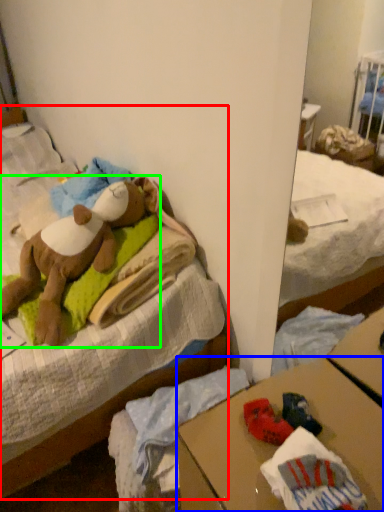
Question: Which object is the farthest from bed (highlighted by a red box)? Choose among these: desk (highlighted by a blue box) or teddy bear (highlighted by a green box).

Choices:
 (A) desk
 (B) teddy bear

Answer: (A)